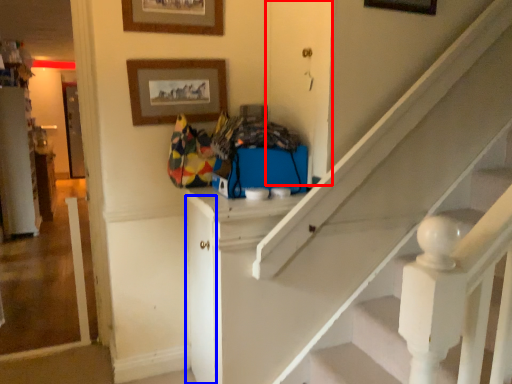
Question: Among these objects, which one is farthest to the camera, door (highlighted by a red box) or door (highlighted by a blue box)?

Choices:
 (A) door
 (B) door

Answer: (B)